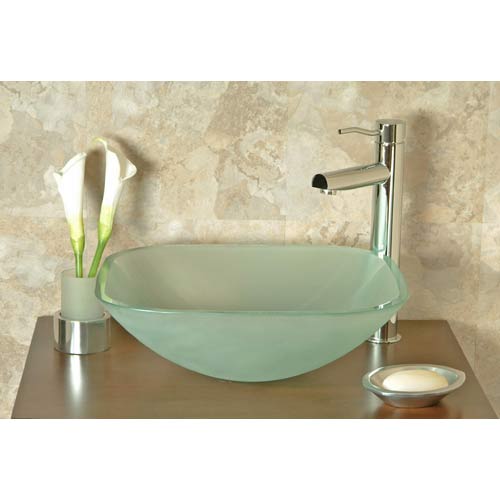
What are the coordinates of `faucet` in the screenshot? It's located at (390, 134).